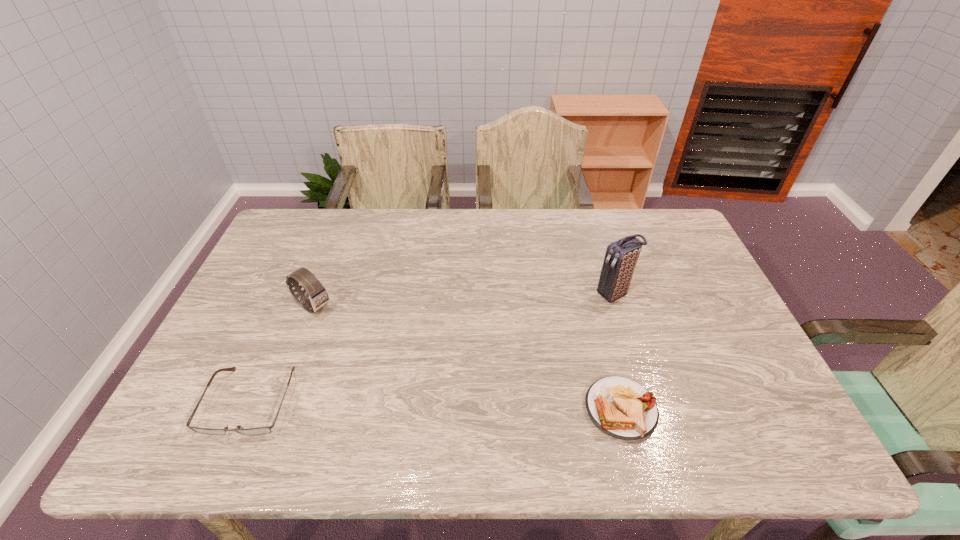
Locate an element on the screen. This screenshot has width=960, height=540. blank space at the far right corner of the desktop is located at coordinates (649, 228).

I want to click on vacant point located between the spectacles and the tallest object, so click(433, 348).

The width and height of the screenshot is (960, 540). I want to click on vacant area that lies between the third shortest object and the sandwich, so click(467, 357).

What are the coordinates of `free spot between the third shortest object and the spectacles` in the screenshot? It's located at (282, 354).

The height and width of the screenshot is (540, 960). What are the coordinates of `vacant point located between the tallest object and the spectacles` in the screenshot? It's located at (433, 348).

Locate an element on the screen. vacant point located between the second tallest object and the spectacles is located at coordinates (282, 354).

Where is `vacant area between the sandwich and the spectacles`? Image resolution: width=960 pixels, height=540 pixels. vacant area between the sandwich and the spectacles is located at coordinates (436, 405).

This screenshot has width=960, height=540. I want to click on empty space that is in between the tallest object and the spectacles, so click(x=433, y=348).

The height and width of the screenshot is (540, 960). I want to click on free area in between the watch and the tallest object, so click(464, 300).

Image resolution: width=960 pixels, height=540 pixels. What are the coordinates of `unoccupied area between the sandwich and the spectacles` in the screenshot? It's located at (436, 405).